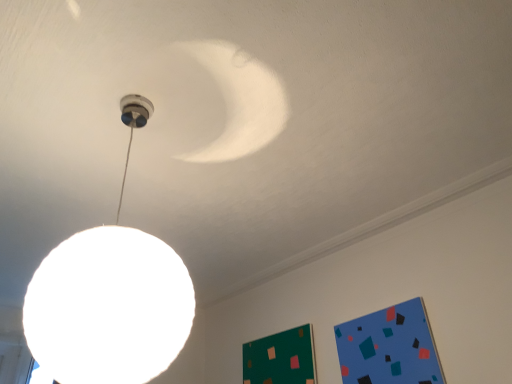
In order to face green matte bulletin board at lower right, the 2th bulletin board from the front, should I rotate leftwards or rightwards?

It's best to rotate right around 2.479 degrees.

You are a GUI agent. You are given a task and a screenshot of the screen. Output one action in this format:
    pyautogui.click(x=<x>, y=<y>)
    Task: Click on the blue matte bulletin board at lower right, the 2th bulletin board in the back-to-front sequence
    The width and height of the screenshot is (512, 384).
    Given the screenshot: What is the action you would take?
    pyautogui.click(x=389, y=347)

Identify the location of white matte ceiling at upper center. (391, 291).

You are a GUI agent. You are given a task and a screenshot of the screen. Output one action in this format:
    pyautogui.click(x=<x>, y=<y>)
    Task: Click on the green matte bulletin board at lower right, the first bulletin board from the back
    This screenshot has height=384, width=512.
    Given the screenshot: What is the action you would take?
    pyautogui.click(x=280, y=358)

In the image, is white matte globe lamp at upper center on the left side or the right side of white matte ceiling at upper center?

Based on their positions, white matte globe lamp at upper center is located to the left of white matte ceiling at upper center.

From a real-world perspective, which is physically below, white matte globe lamp at upper center or white matte ceiling at upper center?

In real-world perspective, white matte globe lamp at upper center is lower.

Looking at the image, does white matte globe lamp at upper center seem bigger or smaller compared to white matte ceiling at upper center?

Considering their sizes, white matte globe lamp at upper center takes up more space than white matte ceiling at upper center.

Does point (145, 321) appear closer or farther from the camera than point (295, 308)?

Point (145, 321) is positioned closer to the camera compared to point (295, 308).

From the image's perspective, is white matte ceiling at upper center on top of blue matte bulletin board at lower right, which is the 2th bulletin board from left to right?

Correct, white matte ceiling at upper center appears higher than blue matte bulletin board at lower right, which is the 2th bulletin board from left to right, in the image.

Is white matte ceiling at upper center at the left side of blue matte bulletin board at lower right, the 2th bulletin board in the back-to-front sequence?

Yes.

Is white matte ceiling at upper center turned away from blue matte bulletin board at lower right, which is the 2th bulletin board from left to right?

That's not correct — white matte ceiling at upper center is not looking away from blue matte bulletin board at lower right, which is the 2th bulletin board from left to right.

Which object is thinner, white matte ceiling at upper center or blue matte bulletin board at lower right, the 2th bulletin board in the back-to-front sequence?

blue matte bulletin board at lower right, the 2th bulletin board in the back-to-front sequence, is thinner.

Is white matte globe lamp at upper center completely or partially inside blue matte bulletin board at lower right, the 2th bulletin board in the back-to-front sequence?

Definitely not — white matte globe lamp at upper center is not inside blue matte bulletin board at lower right, the 2th bulletin board in the back-to-front sequence.

Does blue matte bulletin board at lower right, the 1th bulletin board positioned from the right, have a larger size compared to white matte globe lamp at upper center?

Actually, blue matte bulletin board at lower right, the 1th bulletin board positioned from the right, might be smaller than white matte globe lamp at upper center.

Can you tell me how much blue matte bulletin board at lower right, placed as the first bulletin board when sorted from front to back, and white matte globe lamp at upper center differ in facing direction?

89.7 degrees separate the facing orientations of blue matte bulletin board at lower right, placed as the first bulletin board when sorted from front to back, and white matte globe lamp at upper center.

The width and height of the screenshot is (512, 384). Find the location of `the 2nd bulletin board positioned below the white matte globe lamp at upper center (from the image's perspective)`. the 2nd bulletin board positioned below the white matte globe lamp at upper center (from the image's perspective) is located at coordinates (280, 358).

Is white matte globe lamp at upper center at the left side of green matte bulletin board at lower right, placed as the second bulletin board when sorted from right to left?

Correct, you'll find white matte globe lamp at upper center to the left of green matte bulletin board at lower right, placed as the second bulletin board when sorted from right to left.

Is white matte globe lamp at upper center facing away from green matte bulletin board at lower right, the 2th bulletin board from the front?

That's not correct — white matte globe lamp at upper center is not looking away from green matte bulletin board at lower right, the 2th bulletin board from the front.

Which object is positioned more to the left, blue matte bulletin board at lower right, which is the 2th bulletin board from left to right, or white matte ceiling at upper center?

white matte ceiling at upper center is more to the left.

Does blue matte bulletin board at lower right, the 1th bulletin board positioned from the right, have a lesser width compared to white matte ceiling at upper center?

Indeed, blue matte bulletin board at lower right, the 1th bulletin board positioned from the right, has a lesser width compared to white matte ceiling at upper center.

From a real-world perspective, relative to white matte ceiling at upper center, is blue matte bulletin board at lower right, the 1th bulletin board positioned from the right, vertically above or below?

In terms of real-world spatial position, blue matte bulletin board at lower right, the 1th bulletin board positioned from the right, is below white matte ceiling at upper center.

Is green matte bulletin board at lower right, the first bulletin board from the back, smaller than blue matte bulletin board at lower right, the 2th bulletin board in the back-to-front sequence?

Yes.

Considering the positions of objects green matte bulletin board at lower right, positioned as the 1th bulletin board in left-to-right order, and blue matte bulletin board at lower right, which is the 2th bulletin board from left to right, in the image provided, who is more to the left, green matte bulletin board at lower right, positioned as the 1th bulletin board in left-to-right order, or blue matte bulletin board at lower right, which is the 2th bulletin board from left to right,?

green matte bulletin board at lower right, positioned as the 1th bulletin board in left-to-right order, is more to the left.

From the image's perspective, between green matte bulletin board at lower right, the 2th bulletin board from the front, and blue matte bulletin board at lower right, the 1th bulletin board positioned from the right, who is located below?

green matte bulletin board at lower right, the 2th bulletin board from the front, appears lower in the image.

Who is smaller, white matte ceiling at upper center or green matte bulletin board at lower right, the first bulletin board from the back?

Smaller between the two is white matte ceiling at upper center.

How many degrees apart are the facing directions of white matte ceiling at upper center and green matte bulletin board at lower right, the 2th bulletin board from the front?

1.52 degrees.

Considering the relative sizes of white matte ceiling at upper center and green matte bulletin board at lower right, the first bulletin board from the back, in the image provided, is white matte ceiling at upper center wider than green matte bulletin board at lower right, the first bulletin board from the back,?

Correct, the width of white matte ceiling at upper center exceeds that of green matte bulletin board at lower right, the first bulletin board from the back.

From the image's perspective, is white matte ceiling at upper center located above or below green matte bulletin board at lower right, placed as the second bulletin board when sorted from right to left?

From the image's perspective, white matte ceiling at upper center appears above green matte bulletin board at lower right, placed as the second bulletin board when sorted from right to left.

Image resolution: width=512 pixels, height=384 pixels. Identify the location of lamp above the white matte ceiling at upper center (from the image's perspective). (110, 298).

Find the location of a particular element. This screenshot has height=384, width=512. bulletin board located on the right of white matte ceiling at upper center is located at coordinates (389, 347).

When comparing their distances from white matte ceiling at upper center, does green matte bulletin board at lower right, placed as the second bulletin board when sorted from right to left, or blue matte bulletin board at lower right, the 2th bulletin board in the back-to-front sequence, seem closer?

Based on the image, blue matte bulletin board at lower right, the 2th bulletin board in the back-to-front sequence, appears to be nearer to white matte ceiling at upper center.

Looking at this image, estimate the real-world distances between objects in this image. Which object is closer to white matte globe lamp at upper center, green matte bulletin board at lower right, the first bulletin board from the back, or blue matte bulletin board at lower right, placed as the first bulletin board when sorted from front to back?

Based on the image, blue matte bulletin board at lower right, placed as the first bulletin board when sorted from front to back, appears to be nearer to white matte globe lamp at upper center.

When comparing their distances from white matte ceiling at upper center, does white matte globe lamp at upper center or green matte bulletin board at lower right, the first bulletin board from the back, seem further?

white matte globe lamp at upper center lies further to white matte ceiling at upper center than the other object.

From the image, which object appears to be farther from blue matte bulletin board at lower right, the 1th bulletin board positioned from the right, white matte globe lamp at upper center or white matte ceiling at upper center?

white matte globe lamp at upper center is further to blue matte bulletin board at lower right, the 1th bulletin board positioned from the right.

Looking at the image, which one is located closer to white matte globe lamp at upper center, white matte ceiling at upper center or green matte bulletin board at lower right, the first bulletin board from the back?

Among the two, white matte ceiling at upper center is located nearer to white matte globe lamp at upper center.

From the image, which object appears to be nearer to green matte bulletin board at lower right, placed as the second bulletin board when sorted from right to left, white matte globe lamp at upper center or blue matte bulletin board at lower right, placed as the first bulletin board when sorted from front to back?

The object closer to green matte bulletin board at lower right, placed as the second bulletin board when sorted from right to left, is blue matte bulletin board at lower right, placed as the first bulletin board when sorted from front to back.

Which object lies further to the anchor point white matte globe lamp at upper center, blue matte bulletin board at lower right, the 1th bulletin board positioned from the right, or green matte bulletin board at lower right, the first bulletin board from the back?

Among the two, green matte bulletin board at lower right, the first bulletin board from the back, is located further to white matte globe lamp at upper center.

Considering their positions, is green matte bulletin board at lower right, placed as the second bulletin board when sorted from right to left, positioned closer to white matte globe lamp at upper center than white matte ceiling at upper center?

white matte ceiling at upper center.

Identify the location of backdrop between white matte globe lamp at upper center and green matte bulletin board at lower right, the first bulletin board from the back, from front to back. The image size is (512, 384). (391, 291).

Locate an element on the screen. bulletin board between white matte ceiling at upper center and green matte bulletin board at lower right, placed as the second bulletin board when sorted from right to left, from top to bottom is located at coordinates (389, 347).

The height and width of the screenshot is (384, 512). Find the location of `bulletin board positioned between white matte globe lamp at upper center and green matte bulletin board at lower right, positioned as the 1th bulletin board in left-to-right order, from near to far`. bulletin board positioned between white matte globe lamp at upper center and green matte bulletin board at lower right, positioned as the 1th bulletin board in left-to-right order, from near to far is located at coordinates (389, 347).

At what (x,y) coordinates should I click in order to perform the action: click on backdrop positioned between white matte globe lamp at upper center and blue matte bulletin board at lower right, the 1th bulletin board positioned from the right, from near to far. Please return your answer as a coordinate pair (x, y). Looking at the image, I should click on (391, 291).